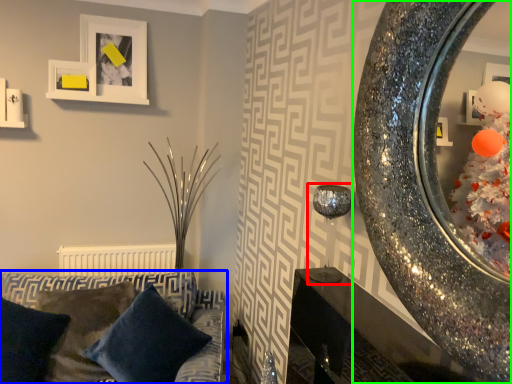
Question: Which object is positioned closest to candle holder (highlighted by a red box)? Select from studio couch (highlighted by a blue box) and mirror (highlighted by a green box).

Choices:
 (A) studio couch
 (B) mirror

Answer: (B)